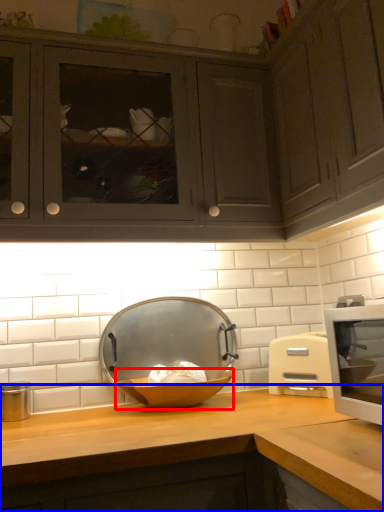
Question: Among these objects, which one is farthest to the camera, bowl (highlighted by a red box) or countertop (highlighted by a blue box)?

Choices:
 (A) bowl
 (B) countertop

Answer: (A)